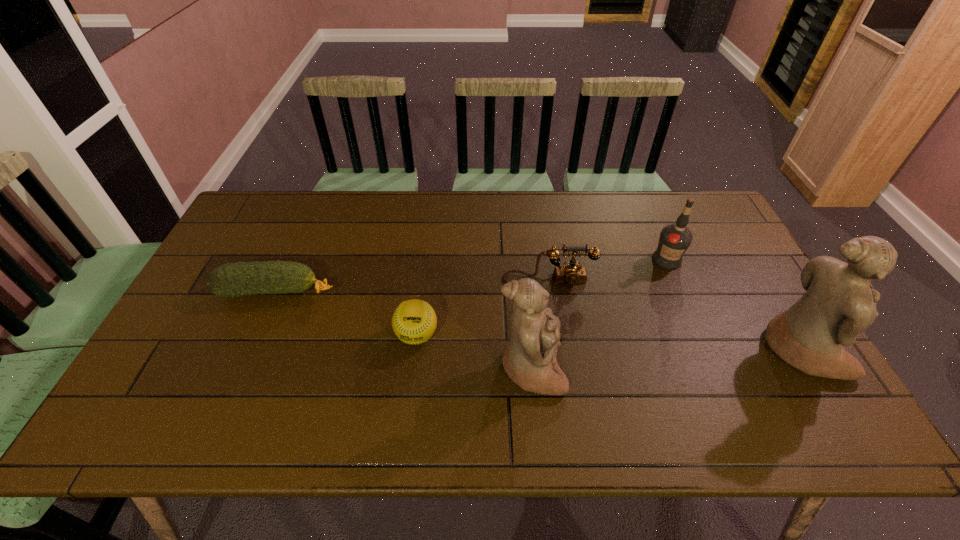
I want to click on free space at the left edge, so click(x=177, y=341).

This screenshot has width=960, height=540. Identify the location of free space at the right edge. (704, 239).

You are a GUI agent. You are given a task and a screenshot of the screen. Output one action in this format:
    pyautogui.click(x=<x>, y=<y>)
    Task: Click on the vacant area at the far left corner
    
    Given the screenshot: What is the action you would take?
    pyautogui.click(x=274, y=213)

In the image, there is a desktop. At what (x,y) coordinates should I click in order to perform the action: click on free space at the near left corner. Please return your answer as a coordinate pair (x, y). Looking at the image, I should click on (151, 381).

I want to click on vacant area that lies between the cucumber and the telephone, so click(413, 286).

Identify the location of free space between the shorter figurine and the fifth object from left to right. (599, 314).

The height and width of the screenshot is (540, 960). Identify the location of unoccupied position between the vodka and the taller figurine. (733, 305).

Find the location of a particular element. The width and height of the screenshot is (960, 540). vacant space that is in between the leftmost object and the third tallest object is located at coordinates (472, 275).

Where is `unoccupied position between the left figurine and the softball`? unoccupied position between the left figurine and the softball is located at coordinates (474, 352).

This screenshot has width=960, height=540. I want to click on free spot between the telephone and the taller figurine, so click(x=675, y=315).